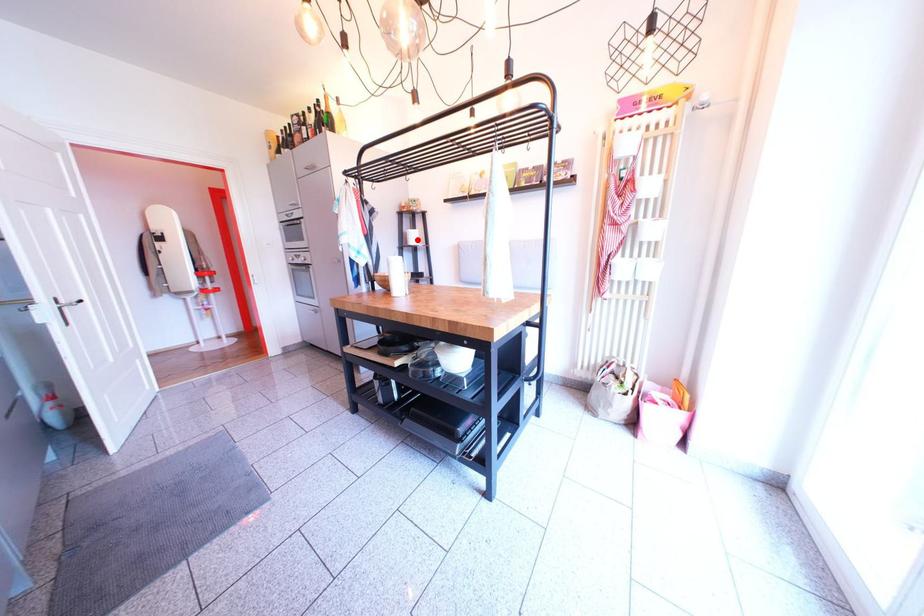
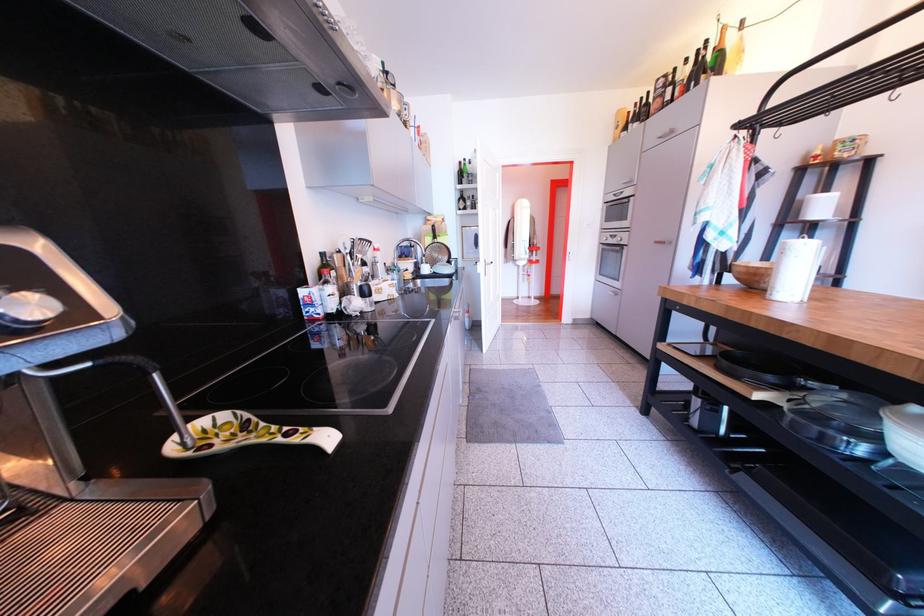
Locate, in the second image, the point that corresponds to the highlighted location in the first image.

(813, 208)